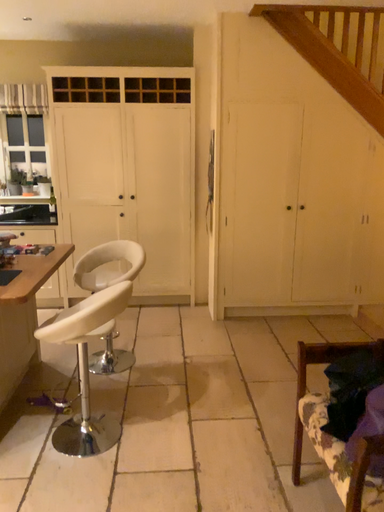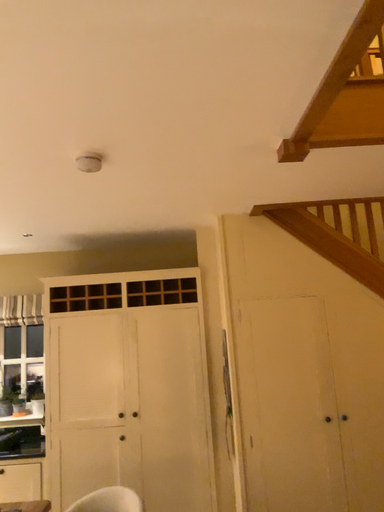
Question: Which way did the camera rotate in the video?

Choices:
 (A) rotated upward
 (B) rotated downward

Answer: (A)